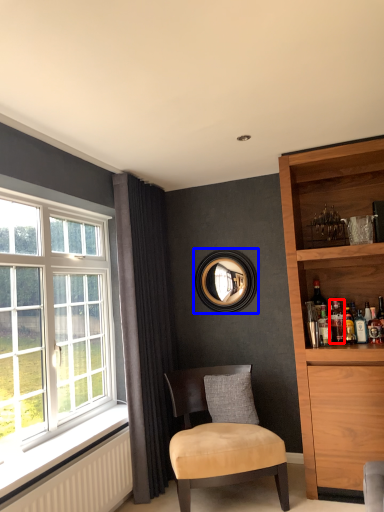
Question: Which point is further to the camera, beverage (highlighted by a red box) or picture frame (highlighted by a blue box)?

Choices:
 (A) beverage
 (B) picture frame

Answer: (B)